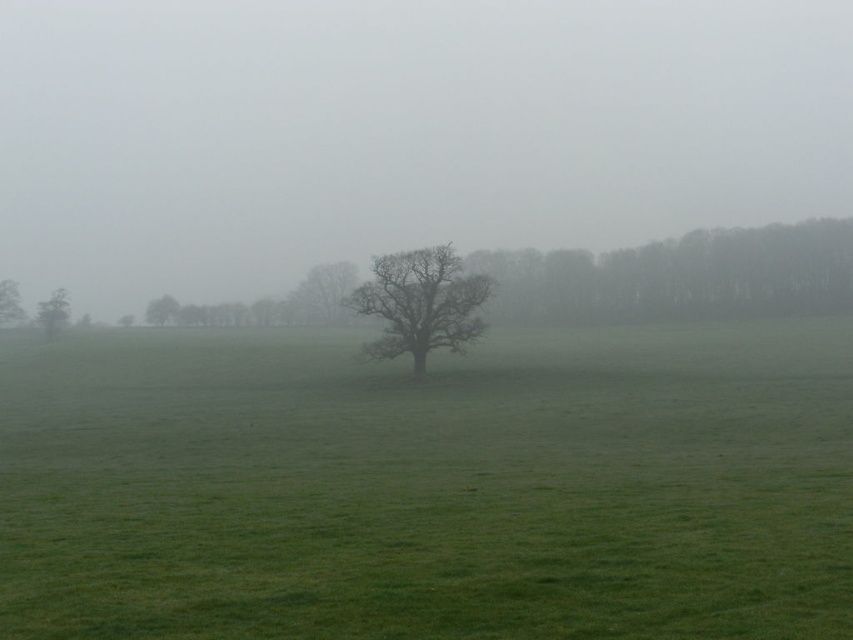
You are standing in the field and want to walk towards the bare wood tree at center. Which direction should you walk relative to the green matte tree at left?

You should walk to the right relative to the green matte tree at left because the bare wood tree at center is positioned to the right of the green matte tree at left.

You are an artist sketching the landscape and want to place the smooth brown tree at left and the green matte tree at left accurately. Which tree is positioned more to the east if the sun is setting in the west?

The smooth brown tree at left is positioned more to the east because it is to the right of the green matte tree at left, and since the sun is setting in the west, the right side of the image corresponds to the east direction.